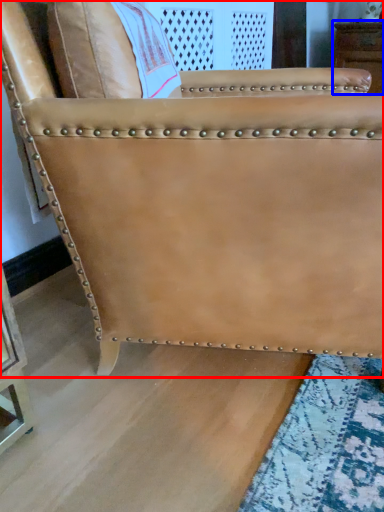
Question: Which of the following is the closest to the observer, chair (highlighted by a red box) or furniture (highlighted by a blue box)?

Choices:
 (A) chair
 (B) furniture

Answer: (A)